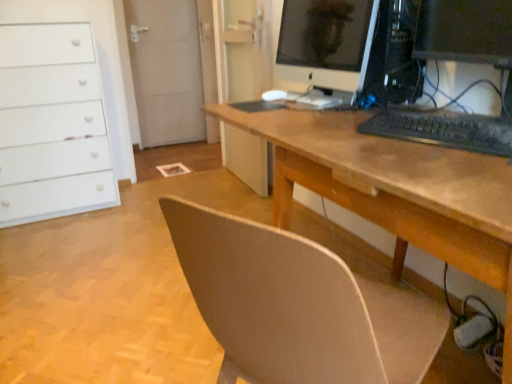
Where is `free space on the front side of white matte chest of drawers at left`? The height and width of the screenshot is (384, 512). free space on the front side of white matte chest of drawers at left is located at coordinates (53, 236).